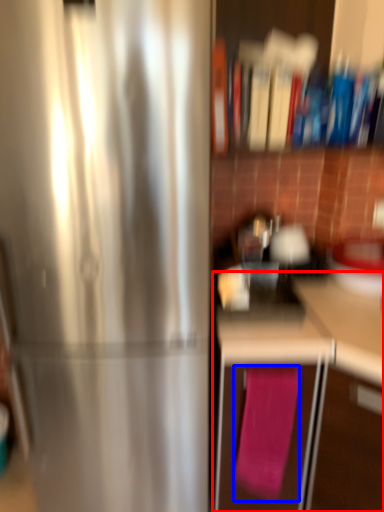
Question: Which object is further to the camera taking this photo, cabinetry (highlighted by a red box) or bath towel (highlighted by a blue box)?

Choices:
 (A) cabinetry
 (B) bath towel

Answer: (B)